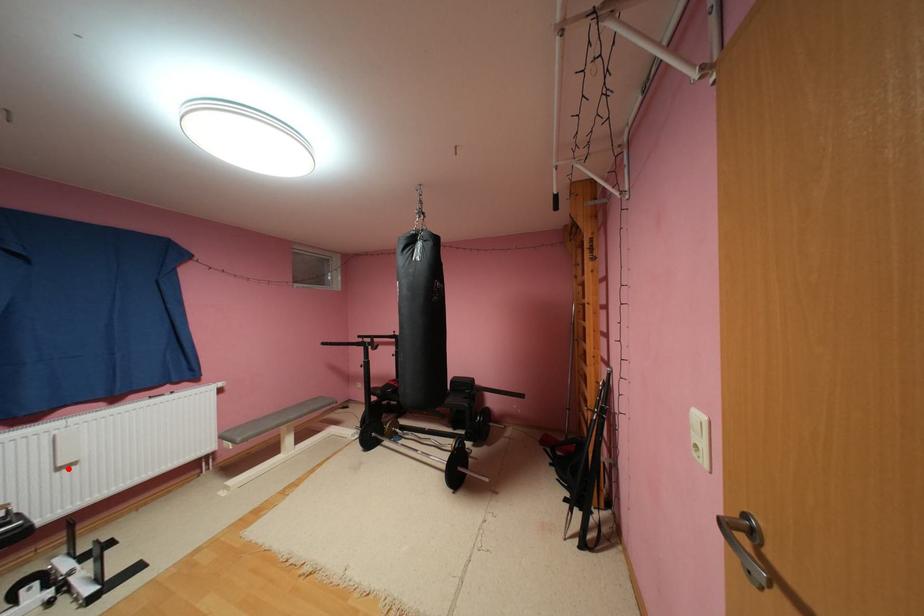
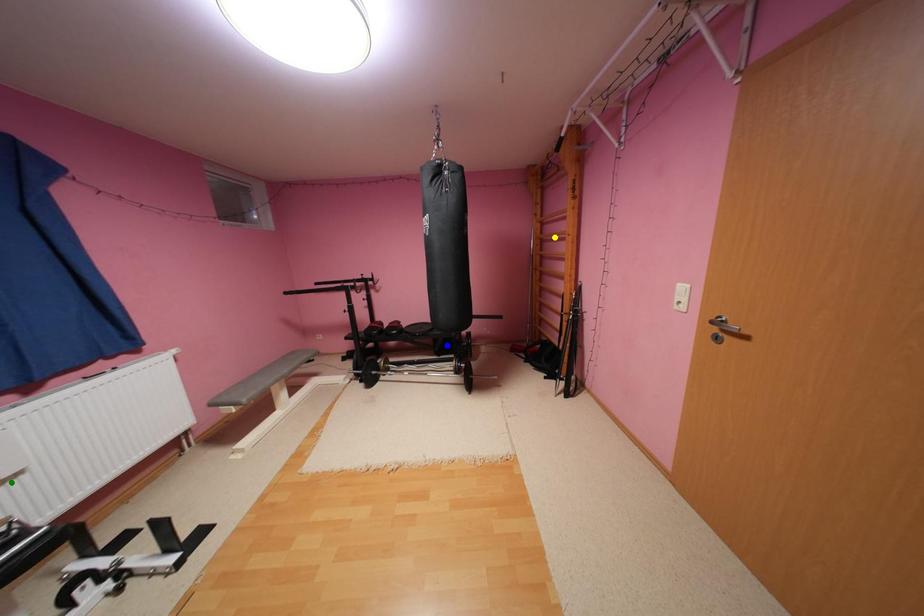
Question: I am providing you with two images of the same scene from different viewpoints. A red point is marked on the first image. You are given multiple points on the second image. In image 2, which mark is for the same physical point as the one in image 1?

Choices:
 (A) yellow point
 (B) green point
 (C) blue point

Answer: (B)